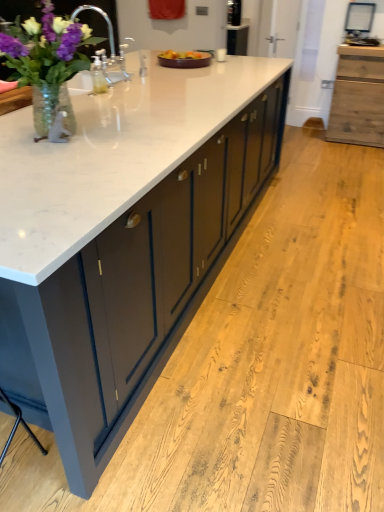
Identify the location of vacant space in front of brown ceramic tray at center. The width and height of the screenshot is (384, 512). (187, 74).